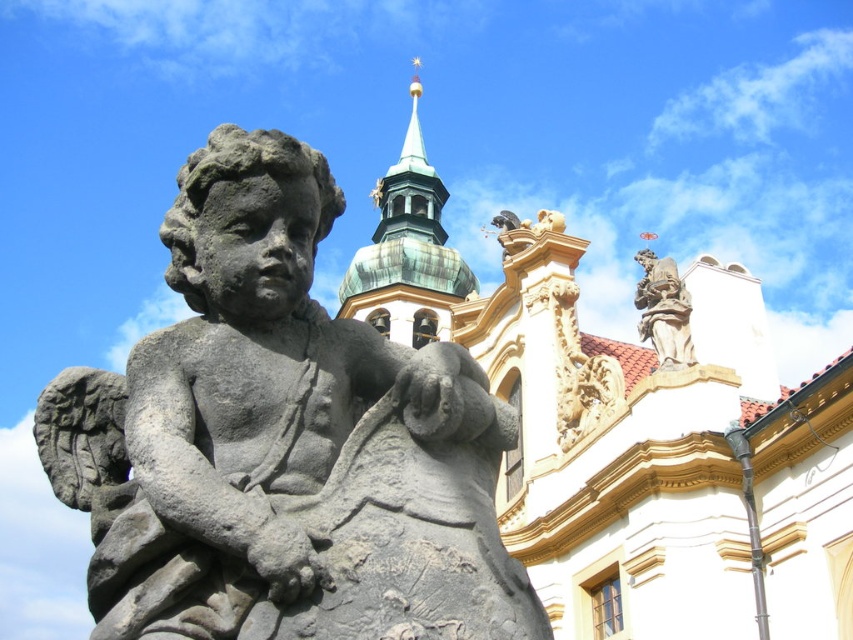
Is point (381, 218) positioned in front of point (664, 282)?

No, (381, 218) is behind (664, 282).

Where is `green copper tower at upper center`? green copper tower at upper center is located at coordinates (407, 250).

I want to click on green copper tower at upper center, so click(x=407, y=250).

Who is more forward, (x=311, y=390) or (x=653, y=300)?

Point (x=311, y=390)

Does gray stone statue at center lie behind stone statue at upper right?

That is False.

The height and width of the screenshot is (640, 853). I want to click on gray stone statue at center, so click(x=282, y=442).

Is gray stone statue at center closer to the viewer compared to green copper tower at upper center?

Yes, gray stone statue at center is closer to the viewer.

Where is `gray stone statue at center`? The width and height of the screenshot is (853, 640). gray stone statue at center is located at coordinates (282, 442).